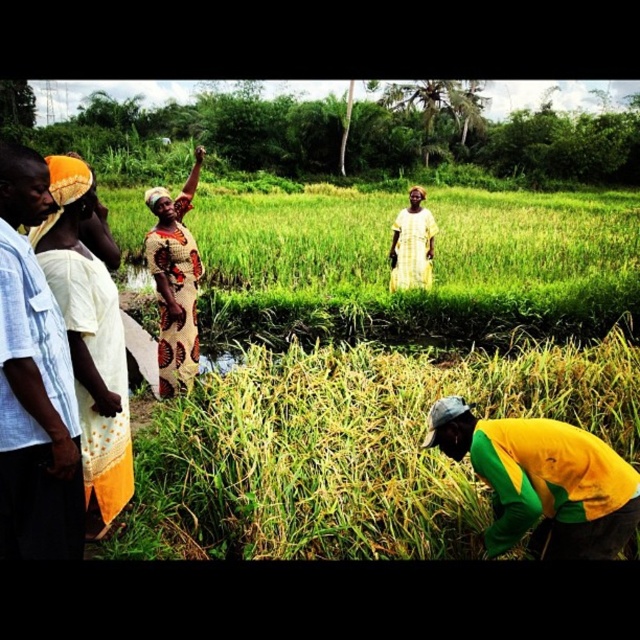
Question: Based on their relative distances, which object is nearer to the yellow-green fabric at lower right?

Choices:
 (A) light blue cotton shirt at left
 (B) printed fabric dress at center
 (C) yellow printed dress at center
 (D) yellow woven cloth at left

Answer: (A)

Question: Which object is the closest to the yellow woven cloth at left?

Choices:
 (A) light blue cotton shirt at left
 (B) yellow printed dress at center

Answer: (A)

Question: Is light blue cotton shirt at left smaller than yellow-green fabric at lower right?

Choices:
 (A) no
 (B) yes

Answer: (A)

Question: Can you confirm if yellow-green grass at lower center is positioned to the left of yellow woven cloth at left?

Choices:
 (A) yes
 (B) no

Answer: (B)

Question: Which point is farther to the camera?

Choices:
 (A) light blue cotton shirt at left
 (B) yellow-green fabric at lower right

Answer: (B)

Question: Is the position of light blue cotton shirt at left less distant than that of yellow printed dress at center?

Choices:
 (A) no
 (B) yes

Answer: (B)